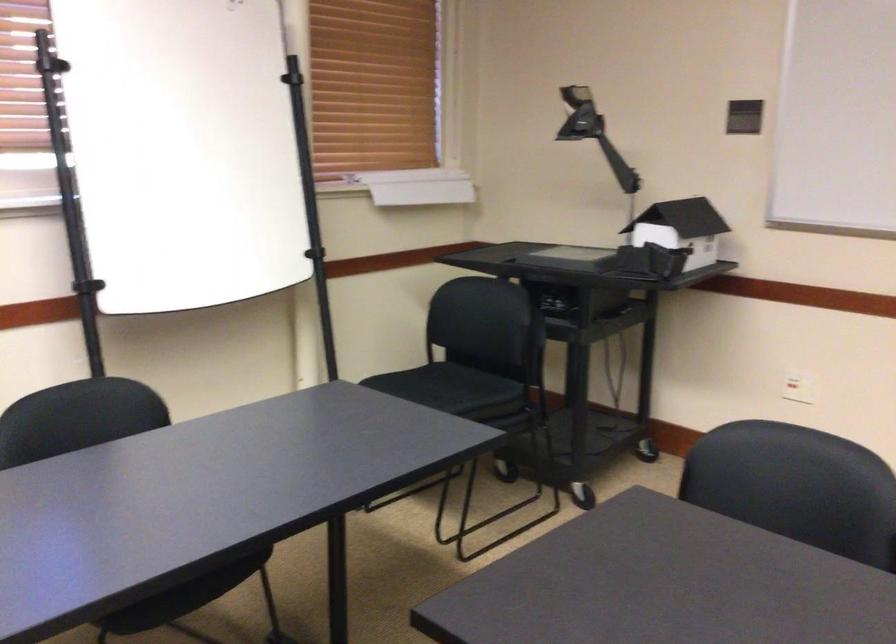
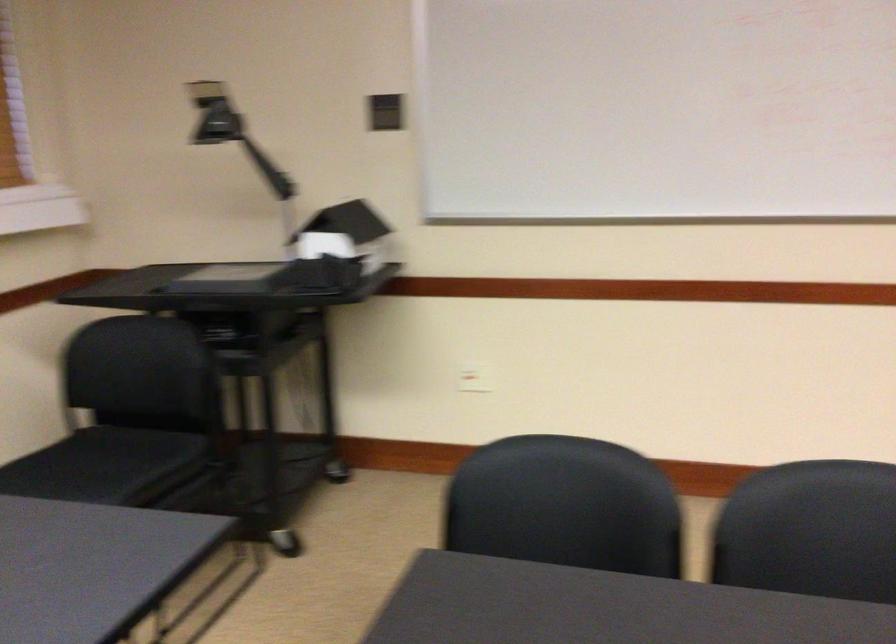
Where in the second image is the point corresponding to [787,480] from the first image?

(561, 494)